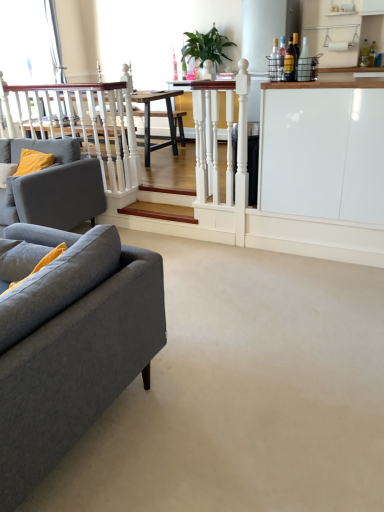
Question: From a real-world perspective, is matte gray fabric couch at left, which appears as the 2th studio couch when viewed from the front, physically below wooden stairs at center?

Choices:
 (A) no
 (B) yes

Answer: (A)

Question: Is matte gray fabric couch at left, which ranks as the first studio couch in back-to-front order, positioned beyond the bounds of wooden stairs at center?

Choices:
 (A) no
 (B) yes

Answer: (B)

Question: Considering the relative sizes of matte gray fabric couch at left, which ranks as the first studio couch in back-to-front order, and wooden stairs at center in the image provided, is matte gray fabric couch at left, which ranks as the first studio couch in back-to-front order, thinner than wooden stairs at center?

Choices:
 (A) yes
 (B) no

Answer: (B)

Question: Does matte gray fabric couch at left, which appears as the 2th studio couch when viewed from the front, have a greater height compared to wooden stairs at center?

Choices:
 (A) no
 (B) yes

Answer: (B)

Question: From the image's perspective, is matte gray fabric couch at left, which ranks as the first studio couch in back-to-front order, under wooden stairs at center?

Choices:
 (A) no
 (B) yes

Answer: (A)

Question: From their relative heights in the image, would you say green leafy plant at upper center is taller or shorter than gray fabric couch at left, the 2th studio couch from the back?

Choices:
 (A) tall
 (B) short

Answer: (B)

Question: From a real-world perspective, is green leafy plant at upper center above or below gray fabric couch at left, which is counted as the 1th studio couch, starting from the front?

Choices:
 (A) below
 (B) above

Answer: (B)

Question: Would you say green leafy plant at upper center is inside or outside gray fabric couch at left, which is counted as the 1th studio couch, starting from the front?

Choices:
 (A) outside
 (B) inside

Answer: (A)

Question: Considering the positions of point (210, 46) and point (6, 353), is point (210, 46) closer or farther from the camera than point (6, 353)?

Choices:
 (A) closer
 (B) farther

Answer: (B)

Question: From the image's perspective, is wooden stairs at center positioned above or below gray fabric couch at left, the 2th studio couch from the back?

Choices:
 (A) above
 (B) below

Answer: (A)

Question: Based on their sizes in the image, would you say wooden stairs at center is bigger or smaller than gray fabric couch at left, which is counted as the 1th studio couch, starting from the front?

Choices:
 (A) big
 (B) small

Answer: (B)

Question: Is wooden stairs at center wider or thinner than gray fabric couch at left, the 2th studio couch from the back?

Choices:
 (A) thin
 (B) wide

Answer: (A)

Question: From a real-world perspective, is wooden stairs at center positioned above or below gray fabric couch at left, which is counted as the 1th studio couch, starting from the front?

Choices:
 (A) below
 (B) above

Answer: (A)

Question: Is white glossy cabinet at right taller or shorter than matte gray fabric couch at left, which appears as the 2th studio couch when viewed from the front?

Choices:
 (A) short
 (B) tall

Answer: (B)

Question: In terms of width, does white glossy cabinet at right look wider or thinner when compared to matte gray fabric couch at left, which ranks as the first studio couch in back-to-front order?

Choices:
 (A) thin
 (B) wide

Answer: (A)